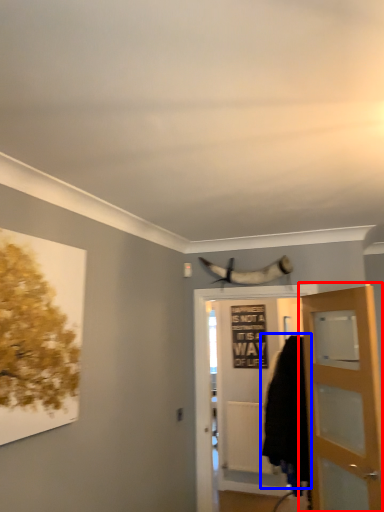
Question: Which object is closer to the camera taking this photo, door (highlighted by a red box) or cloak (highlighted by a blue box)?

Choices:
 (A) door
 (B) cloak

Answer: (A)